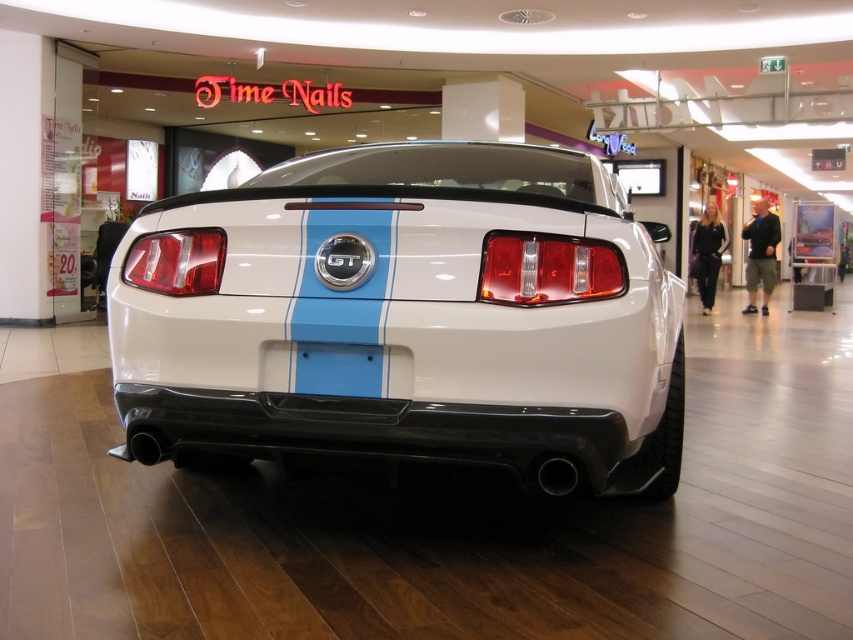
Question: Estimate the real-world distances between objects in this image. Which object is closer to the white glossy car at center?

Choices:
 (A) matte red tail light at center
 (B) translucent red tail light at center

Answer: (B)

Question: Is white glossy car at center positioned at the back of translucent red tail light at center?

Choices:
 (A) no
 (B) yes

Answer: (A)

Question: Which of the following is the farthest from the observer?

Choices:
 (A) translucent red tail light at center
 (B) matte red tail light at center
 (C) white glossy car at center

Answer: (B)

Question: From the image, what is the correct spatial relationship of translucent red tail light at center in relation to matte red tail light at center?

Choices:
 (A) right
 (B) left

Answer: (A)

Question: Does white glossy car at center lie in front of translucent red tail light at center?

Choices:
 (A) no
 (B) yes

Answer: (B)

Question: Which object appears farthest from the camera in this image?

Choices:
 (A) translucent red tail light at center
 (B) matte red tail light at center

Answer: (B)